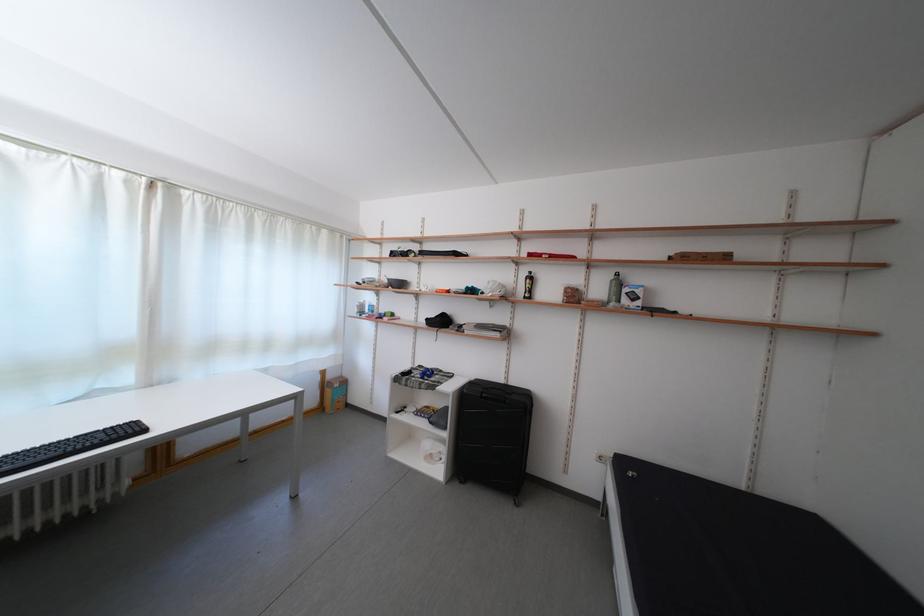
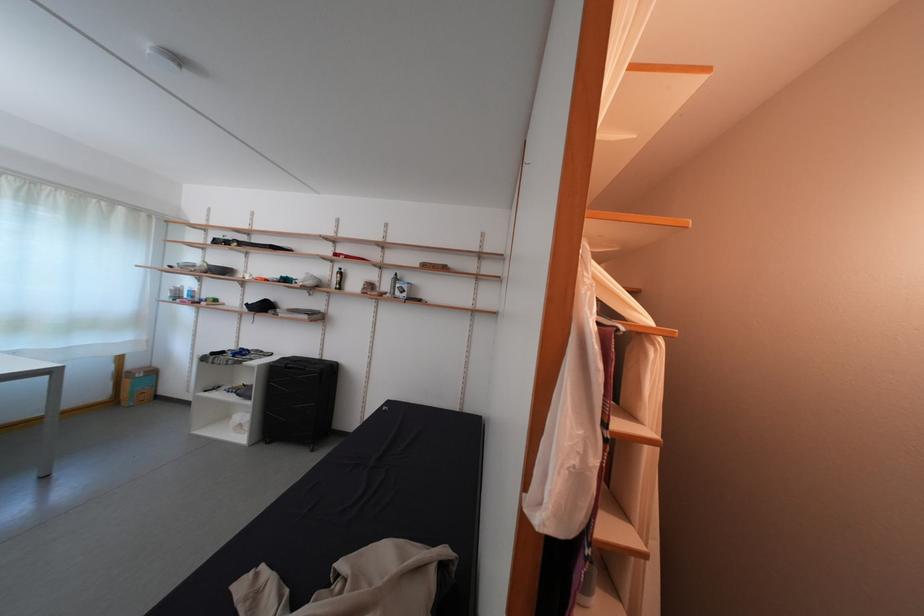
Where in the second image is the point corresponding to pixel 338 382 from the first image?

(140, 371)